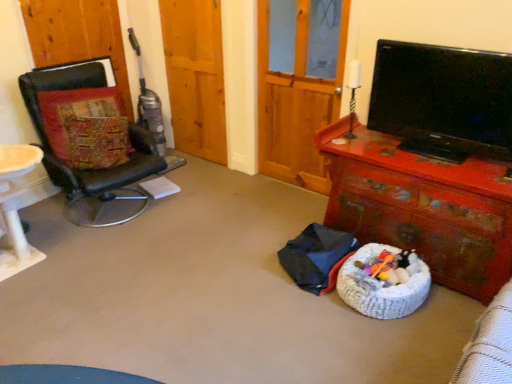
Where is `free spot in front of white woven dog bed at lower center`? This screenshot has width=512, height=384. free spot in front of white woven dog bed at lower center is located at coordinates (395, 345).